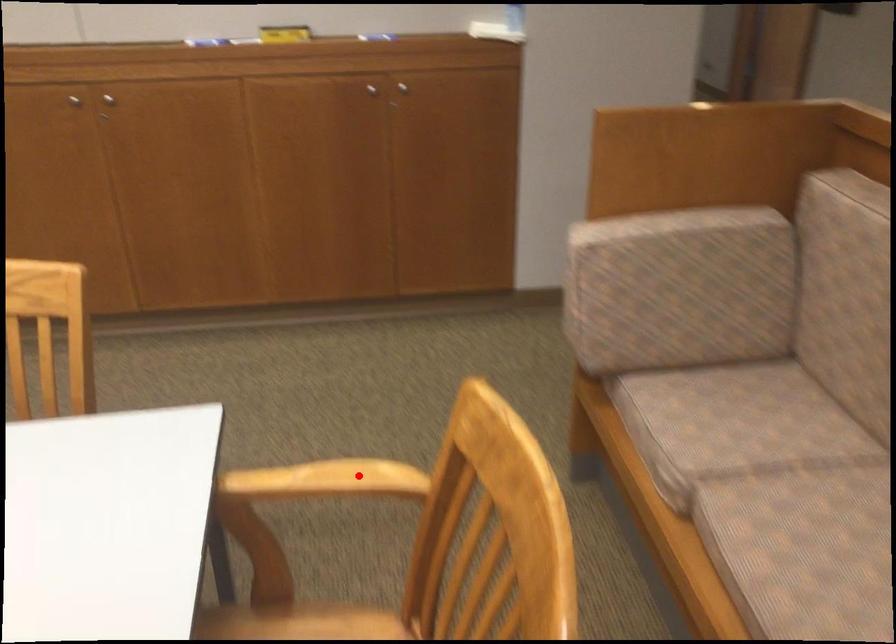
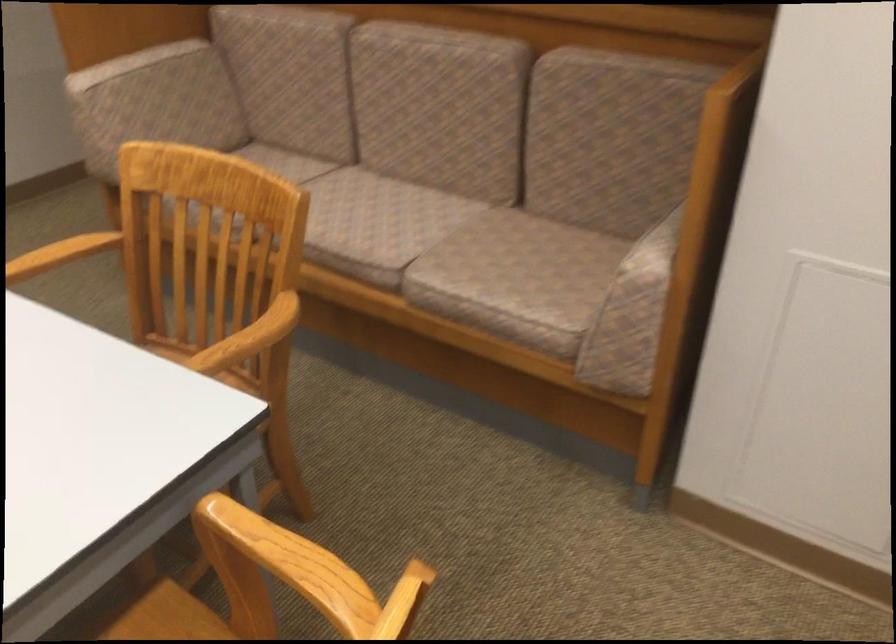
Question: I am providing you with two images of the same scene from different viewpoints. A red point is shown in image1. For the corresponding object point in image2, is it positioned nearer or farther from the camera?

Choices:
 (A) Nearer
 (B) Farther

Answer: (B)